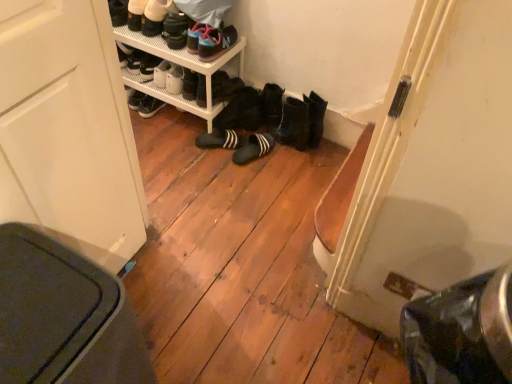
Question: Considering the relative positions of matte black sneakers at upper center, marked as the 5th footwear in a bottom-to-top arrangement, and white plastic shelf at upper center in the image provided, is matte black sneakers at upper center, marked as the 5th footwear in a bottom-to-top arrangement, to the left of white plastic shelf at upper center from the viewer's perspective?

Choices:
 (A) yes
 (B) no

Answer: (B)

Question: Is matte black sneakers at upper center, the 3th footwear from the top, not inside white plastic shelf at upper center?

Choices:
 (A) no
 (B) yes

Answer: (B)

Question: Does matte black sneakers at upper center, marked as the 5th footwear in a bottom-to-top arrangement, have a smaller size compared to white plastic shelf at upper center?

Choices:
 (A) yes
 (B) no

Answer: (A)

Question: Considering the relative sizes of matte black sneakers at upper center, the 3th footwear from the top, and white plastic shelf at upper center in the image provided, is matte black sneakers at upper center, the 3th footwear from the top, thinner than white plastic shelf at upper center?

Choices:
 (A) no
 (B) yes

Answer: (B)

Question: Does matte black sneakers at upper center, the 3th footwear from the top, touch white plastic shelf at upper center?

Choices:
 (A) no
 (B) yes

Answer: (A)

Question: Considering the positions of white plastic shelf at upper center and matte black shoes at upper center, which is the 6th footwear from bottom to top, in the image, is white plastic shelf at upper center taller or shorter than matte black shoes at upper center, which is the 6th footwear from bottom to top,?

Choices:
 (A) tall
 (B) short

Answer: (A)

Question: Is white plastic shelf at upper center bigger or smaller than matte black shoes at upper center, the 2th footwear from the top?

Choices:
 (A) big
 (B) small

Answer: (A)

Question: Is white plastic shelf at upper center inside the boundaries of matte black shoes at upper center, the 2th footwear from the top, or outside?

Choices:
 (A) inside
 (B) outside

Answer: (B)

Question: From the image's perspective, is white plastic shelf at upper center located above or below matte black shoes at upper center, the 2th footwear from the top?

Choices:
 (A) below
 (B) above

Answer: (A)

Question: In the image, is matte black sneakers at upper center, marked as the 5th footwear in a bottom-to-top arrangement, positioned in front of or behind white plastic shelf at upper center?

Choices:
 (A) behind
 (B) front

Answer: (B)

Question: From the image's perspective, is matte black sneakers at upper center, marked as the 5th footwear in a bottom-to-top arrangement, positioned above or below white plastic shelf at upper center?

Choices:
 (A) above
 (B) below

Answer: (A)

Question: Would you say matte black sneakers at upper center, the 3th footwear from the top, is to the left or to the right of white plastic shelf at upper center in the picture?

Choices:
 (A) left
 (B) right

Answer: (B)

Question: In terms of width, does matte black sneakers at upper center, marked as the 5th footwear in a bottom-to-top arrangement, look wider or thinner when compared to white plastic shelf at upper center?

Choices:
 (A) wide
 (B) thin

Answer: (B)

Question: Choose the correct answer: Is matte black sneakers at upper center, marked as the 5th footwear in a bottom-to-top arrangement, inside black suede slippers at center, marked as the 6th footwear in a top-to-bottom arrangement, or outside it?

Choices:
 (A) inside
 (B) outside

Answer: (B)

Question: From a real-world perspective, relative to black suede slippers at center, marked as the 6th footwear in a top-to-bottom arrangement, is matte black sneakers at upper center, marked as the 5th footwear in a bottom-to-top arrangement, vertically above or below?

Choices:
 (A) above
 (B) below

Answer: (A)